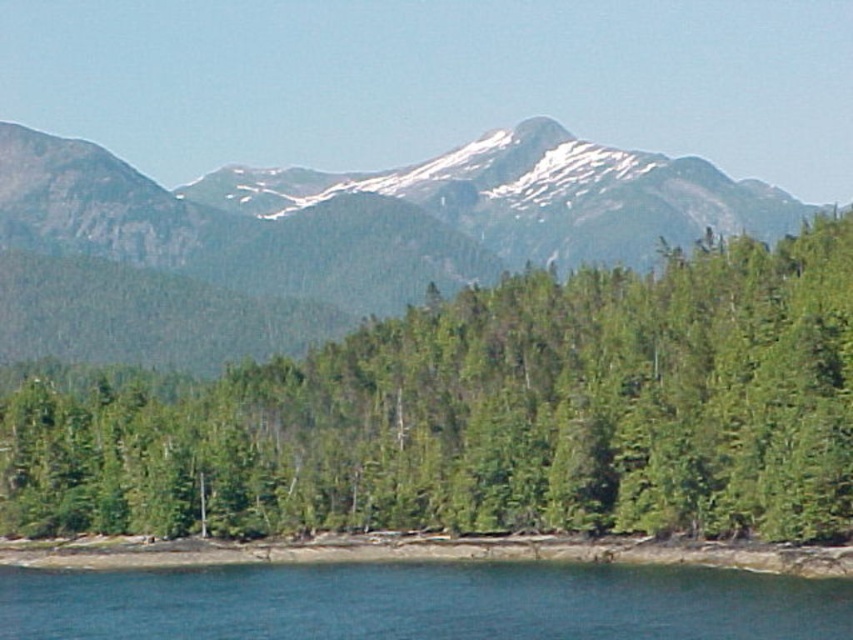
Who is taller, green matte tree at center or clear blue water at lower center?

With more height is green matte tree at center.

Between green matte tree at center and clear blue water at lower center, which one appears on the left side from the viewer's perspective?

clear blue water at lower center is more to the left.

Is point (741, 323) in front of point (577, 602)?

No, it is not.

Find the location of `green matte tree at center`. green matte tree at center is located at coordinates (486, 413).

Who is taller, green matte tree at center or brown dirt shoreline at lower center?

With more height is green matte tree at center.

Who is shorter, green matte tree at center or brown dirt shoreline at lower center?

brown dirt shoreline at lower center

Find the location of a particular element. Image resolution: width=853 pixels, height=640 pixels. green matte tree at center is located at coordinates (486, 413).

Between green matte tree at center and green forested mountain at upper center, which one appears on the right side from the viewer's perspective?

From the viewer's perspective, green matte tree at center appears more on the right side.

Is green matte tree at center bigger than green forested mountain at upper center?

No.

Identify the location of green matte tree at center. This screenshot has height=640, width=853. (486, 413).